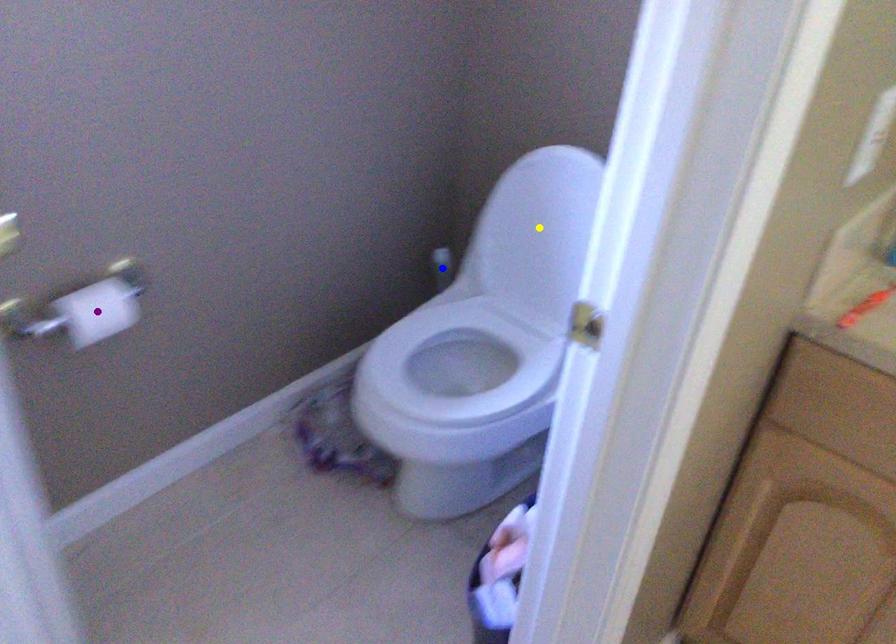
Order these from nearest to farthest:
A) blue point
B) purple point
C) yellow point

purple point → yellow point → blue point